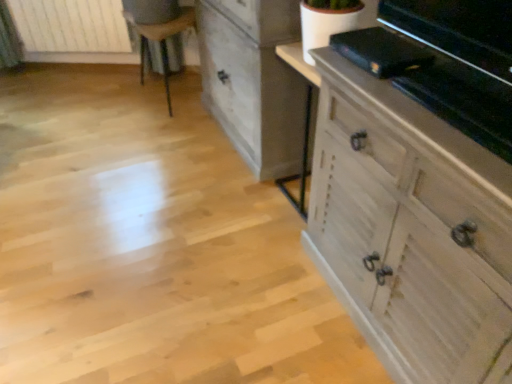
Question: Is wooden chair at upper left thinner than distressed white chest of drawers at center, which is counted as the second chest of drawers, starting from the front?

Choices:
 (A) yes
 (B) no

Answer: (B)

Question: Is wooden chair at upper left further to the viewer compared to distressed white chest of drawers at center, which is the 1th chest of drawers in back-to-front order?

Choices:
 (A) yes
 (B) no

Answer: (A)

Question: Does wooden chair at upper left have a lesser height compared to distressed white chest of drawers at center, which is counted as the second chest of drawers, starting from the front?

Choices:
 (A) no
 (B) yes

Answer: (B)

Question: Is distressed white chest of drawers at center, which is counted as the second chest of drawers, starting from the front, at the back of wooden chair at upper left?

Choices:
 (A) yes
 (B) no

Answer: (B)

Question: Is distressed white chest of drawers at center, which is counted as the second chest of drawers, starting from the front, located within wooden chair at upper left?

Choices:
 (A) no
 (B) yes

Answer: (A)

Question: From the image's perspective, does wooden chair at upper left appear higher than distressed white chest of drawers at center, which is the 1th chest of drawers in back-to-front order?

Choices:
 (A) no
 (B) yes

Answer: (B)

Question: Is distressed white chest of drawers at center, which is counted as the second chest of drawers, starting from the front, taller than white wood chest of drawers at right, which ranks as the 1th chest of drawers in front-to-back order?

Choices:
 (A) no
 (B) yes

Answer: (B)

Question: Is distressed white chest of drawers at center, which is the 1th chest of drawers in back-to-front order, aimed at white wood chest of drawers at right, which ranks as the 1th chest of drawers in front-to-back order?

Choices:
 (A) yes
 (B) no

Answer: (B)

Question: Can white wood chest of drawers at right, which ranks as the 1th chest of drawers in front-to-back order, be found inside distressed white chest of drawers at center, which is counted as the second chest of drawers, starting from the front?

Choices:
 (A) no
 (B) yes

Answer: (A)

Question: Does distressed white chest of drawers at center, which is the 1th chest of drawers in back-to-front order, have a lesser height compared to white wood chest of drawers at right, which ranks as the 1th chest of drawers in front-to-back order?

Choices:
 (A) no
 (B) yes

Answer: (A)

Question: Is distressed white chest of drawers at center, which is counted as the second chest of drawers, starting from the front, smaller than white wood chest of drawers at right, which ranks as the 1th chest of drawers in front-to-back order?

Choices:
 (A) yes
 (B) no

Answer: (A)

Question: From the image's perspective, is distressed white chest of drawers at center, which is the 1th chest of drawers in back-to-front order, located above white wood chest of drawers at right, the second chest of drawers positioned from the back?

Choices:
 (A) yes
 (B) no

Answer: (A)

Question: Is white wood chest of drawers at right, the second chest of drawers positioned from the back, at the right side of white wooden radiator at upper left?

Choices:
 (A) no
 (B) yes

Answer: (B)